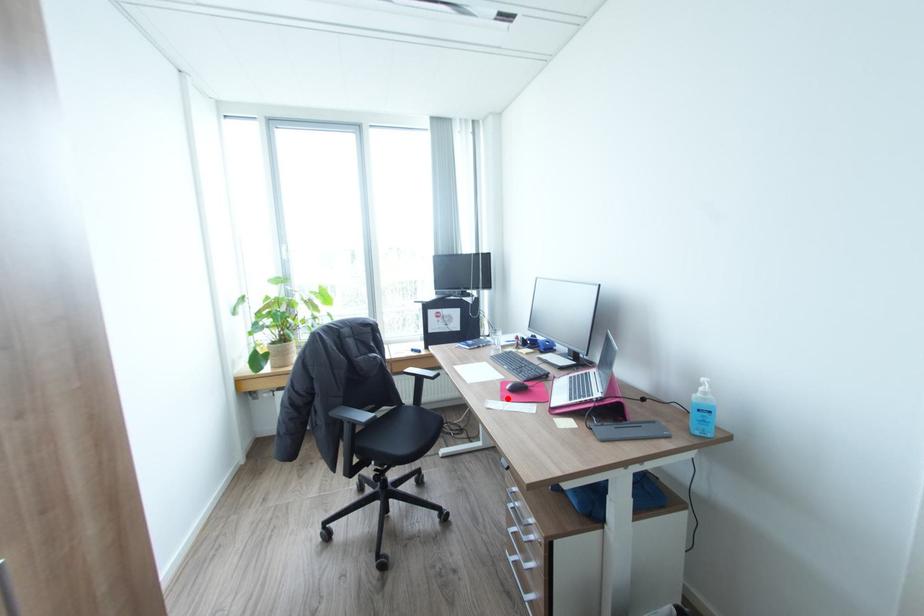
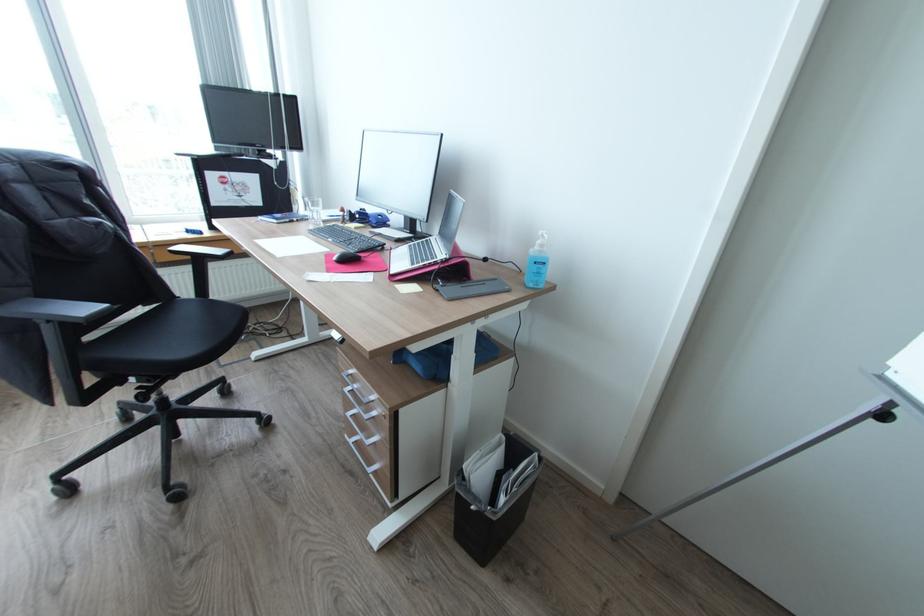
In the second image, find the point that corresponds to the highlighted location in the first image.

(334, 270)